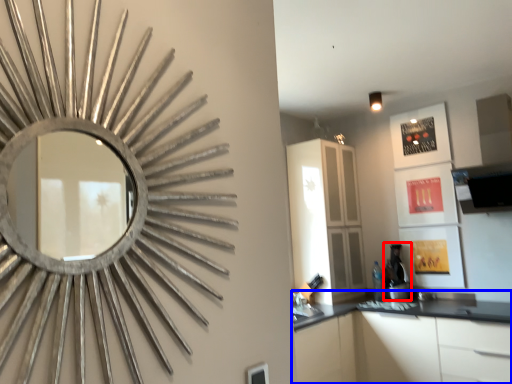
Question: Which of the following is the farthest to the observer, coffee machine (highlighted by a red box) or cabinetry (highlighted by a blue box)?

Choices:
 (A) coffee machine
 (B) cabinetry

Answer: (A)